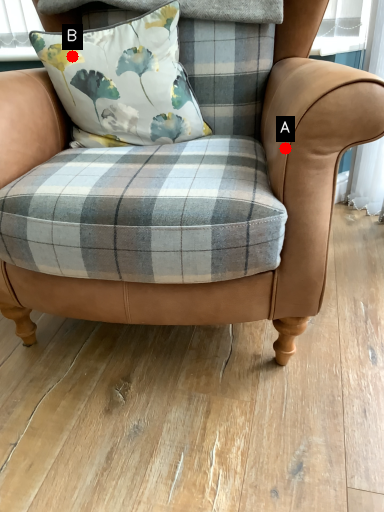
Question: Two points are circled on the image, labeled by A and B beside each circle. Which point is closer to the camera taking this photo?

Choices:
 (A) A is closer
 (B) B is closer

Answer: (A)